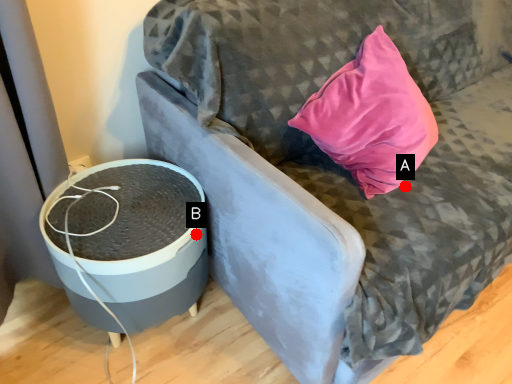
Question: Two points are circled on the image, labeled by A and B beside each circle. Which of the following is the farthest from the observer?

Choices:
 (A) A is further
 (B) B is further

Answer: (A)